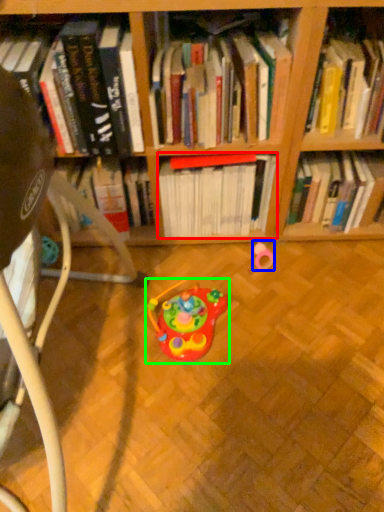
Question: Estimate the real-world distances between objects in this image. Which object is closer to book (highlighted by a red box), toy (highlighted by a blue box) or toy (highlighted by a green box)?

Choices:
 (A) toy
 (B) toy

Answer: (A)